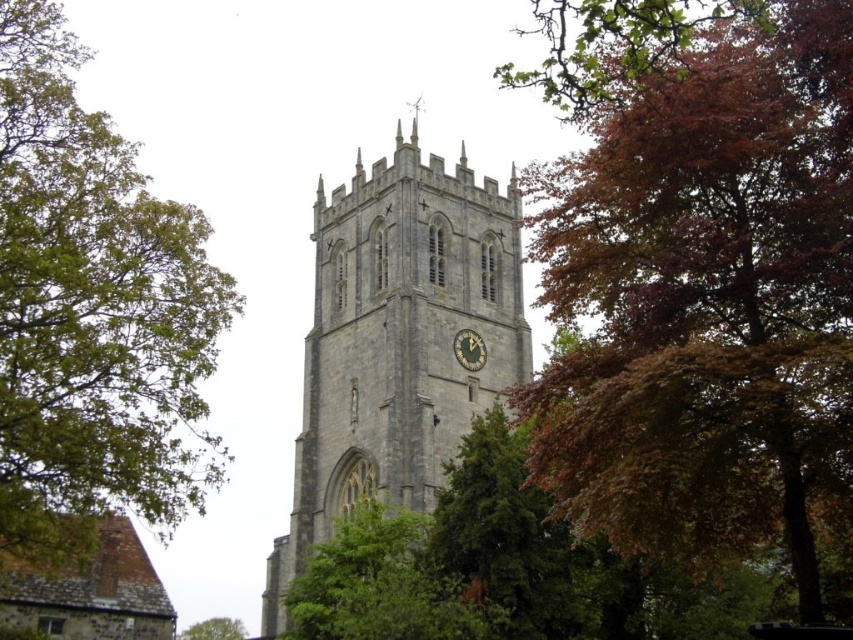
You are an architect evaluating the church tower. You notice the autumn leaves at upper right and the dark gray stone clock at center. Which object appears larger in the image?

The autumn leaves at upper right is bigger than the dark gray stone clock at center, so the autumn leaves at upper right appears larger in the image.

You are standing in a park and see the green leafy tree at left and the gray stone church tower at center. Which object is positioned higher in the scene?

The green leafy tree at left is located above the gray stone church tower at center, so it is positioned higher in the scene.